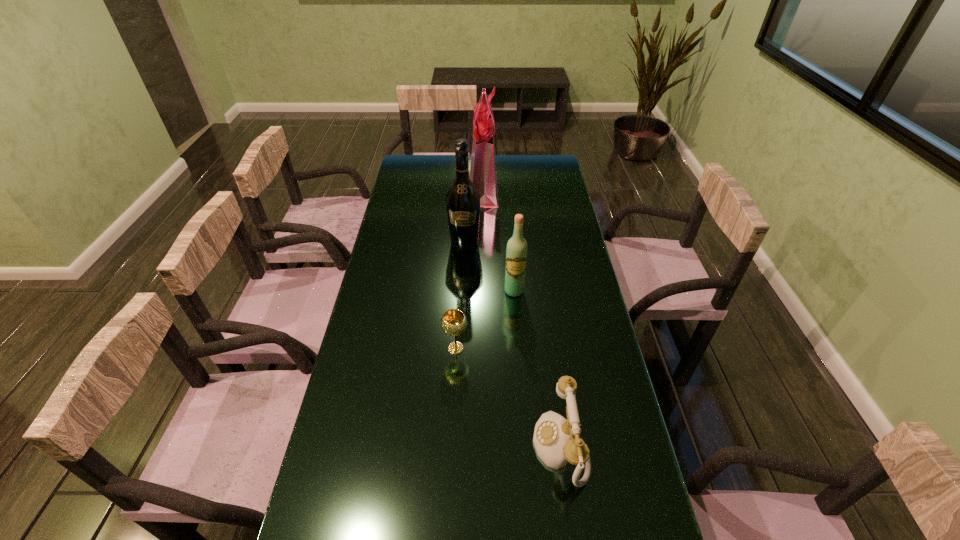
The height and width of the screenshot is (540, 960). Identify the location of the fourth closest object to the farthest object. (557, 441).